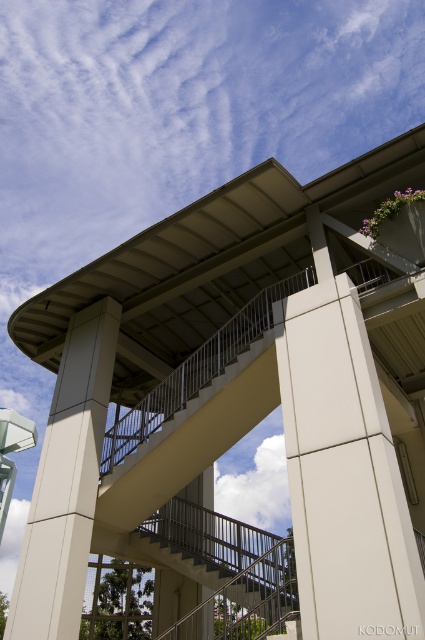
You are an architect analyzing the structural integrity of the building. You notice two pillars supporting the overhang. Which pillar, the white smooth pillar at center or the beige concrete pillar at center, is more likely to bear less weight?

The white smooth pillar at center is smaller in size compared to the beige concrete pillar at center, so it is more likely to bear less weight.

You are an architect designing a new building. You want to place a large sculpture between the white smooth pillar at center and the metallic gray staircase at center. Which object should the sculpture be placed closer to if it needs to be near the smaller one?

The sculpture should be placed closer to the metallic gray staircase at center because it is smaller than the white smooth pillar at center.